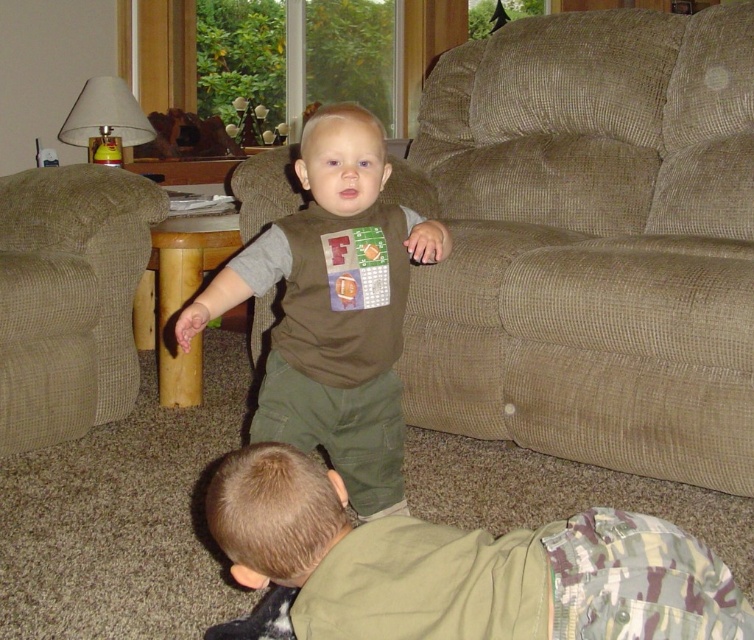
Measure the distance between brown corduroy couch at center and camera.

brown corduroy couch at center and camera are 5.55 feet apart.

Can you confirm if brown corduroy couch at center is positioned below camouflage pants at lower center?

Incorrect, brown corduroy couch at center is not positioned below camouflage pants at lower center.

Does point (411, 396) come closer to viewer compared to point (722, 595)?

No, it is not.

Locate an element on the screen. This screenshot has height=640, width=754. brown corduroy couch at center is located at coordinates (590, 243).

Does camouflage pants at lower center have a larger size compared to brown matte shirt at center?

Incorrect, camouflage pants at lower center is not larger than brown matte shirt at center.

Which is in front, point (520, 570) or point (325, 451)?

Point (520, 570)

At what (x,y) coordinates should I click in order to perform the action: click on camouflage pants at lower center. Please return your answer as a coordinate pair (x, y). Looking at the image, I should click on (461, 566).

What do you see at coordinates (590, 243) in the screenshot? I see `brown corduroy couch at center` at bounding box center [590, 243].

Who is positioned more to the right, brown corduroy couch at center or beige corduroy armchair at left?

brown corduroy couch at center is more to the right.

Where is `brown corduroy couch at center`? brown corduroy couch at center is located at coordinates (590, 243).